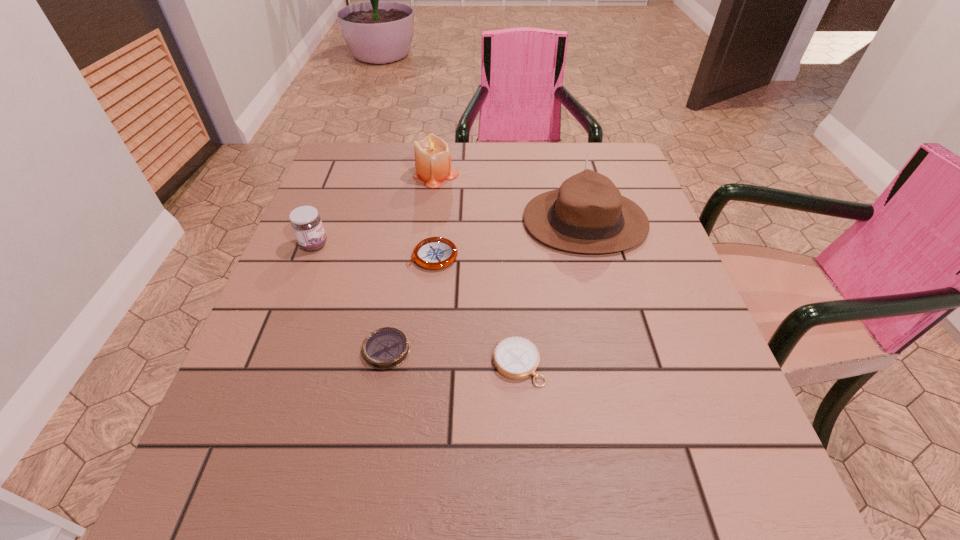
Identify the location of empty space that is in between the tallest compass and the farthest object. (435, 215).

Where is `free area in between the fedora and the fourth tallest object`? The image size is (960, 540). free area in between the fedora and the fourth tallest object is located at coordinates (509, 239).

Locate an element on the screen. This screenshot has width=960, height=540. unoccupied position between the fedora and the shortest compass is located at coordinates (486, 286).

Image resolution: width=960 pixels, height=540 pixels. In order to click on vacant space that's between the rightmost compass and the candle in this screenshot , I will do `click(477, 269)`.

Identify the location of vacant space in between the candle and the fedora. The image size is (960, 540). (511, 198).

Find the location of `blank region between the shortest compass and the fedora`. blank region between the shortest compass and the fedora is located at coordinates (486, 286).

The image size is (960, 540). What are the coordinates of `free space between the fedora and the rightmost compass` in the screenshot? It's located at (552, 293).

You are a GUI agent. You are given a task and a screenshot of the screen. Output one action in this format:
    pyautogui.click(x=<x>, y=<y>)
    Task: Click on the fifth closest object to the shortest object
    This screenshot has width=960, height=540.
    Given the screenshot: What is the action you would take?
    pyautogui.click(x=432, y=157)

Find the location of a particular element. This screenshot has width=960, height=540. the fifth closest object to the shortest object is located at coordinates (432, 157).

Identify which compass is the closest to the rightmost compass. Please provide its 2D coordinates. Your answer should be formatted as a tuple, i.e. [(x, y)], where the tuple contains the x and y coordinates of a point satisfying the conditions above.

[(385, 348)]